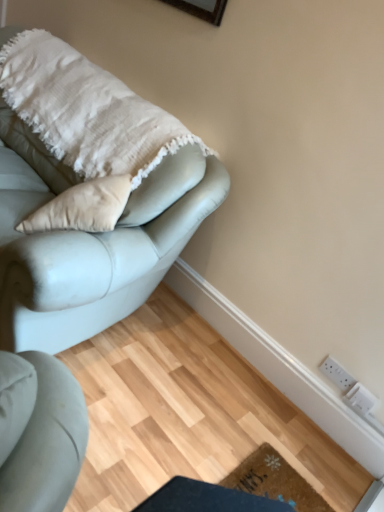
Measure the distance between brown textured mat at lower center and camera.

The depth of brown textured mat at lower center is 1.42 meters.

I want to click on white plastic socket at lower right, which is the first electric outlet in top-to-bottom order, so click(x=337, y=373).

Where is `white textured blanket at upper left`? The image size is (384, 512). white textured blanket at upper left is located at coordinates (86, 111).

Which is correct: white textured blanket at upper left is inside satin light blue couch at upper left, or outside of it?

white textured blanket at upper left lies within the bounds of satin light blue couch at upper left.

Is point (98, 104) less distant than point (12, 225)?

No, (98, 104) is behind (12, 225).

Is satin light blue couch at upper left at the back of white textured blanket at upper left?

Yes, white textured blanket at upper left is facing away from satin light blue couch at upper left.

From a real-world perspective, is white textured blanket at upper left physically located above or below satin light blue couch at upper left?

white textured blanket at upper left is above satin light blue couch at upper left.

From a real-world perspective, who is located higher, white plastic socket at lower right, the 2th electric outlet from the bottom, or white textured blanket at upper left?

From a 3D spatial view, white textured blanket at upper left is above.

Is point (335, 377) positioned after point (135, 188)?

Yes, point (335, 377) is behind point (135, 188).

From the image's perspective, which one is positioned higher, white plastic socket at lower right, which is the first electric outlet in top-to-bottom order, or white textured blanket at upper left?

From the image's view, white textured blanket at upper left is above.

Between white plastic electric outlet at lower right, arranged as the 1th electric outlet when ordered from the bottom, and satin light blue couch at upper left, which one has larger size?

satin light blue couch at upper left.

From the image's perspective, which is below, white plastic electric outlet at lower right, arranged as the 1th electric outlet when ordered from the bottom, or satin light blue couch at upper left?

white plastic electric outlet at lower right, arranged as the 1th electric outlet when ordered from the bottom.

Is white plastic electric outlet at lower right, placed as the 2th electric outlet when sorted from top to bottom, with satin light blue couch at upper left?

No, white plastic electric outlet at lower right, placed as the 2th electric outlet when sorted from top to bottom, is not in contact with satin light blue couch at upper left.

Is the position of white plastic electric outlet at lower right, arranged as the 1th electric outlet when ordered from the bottom, more distant than that of satin light blue couch at upper left?

Yes, white plastic electric outlet at lower right, arranged as the 1th electric outlet when ordered from the bottom, is further from the camera.

Between white textured blanket at upper left and white plastic electric outlet at lower right, placed as the 2th electric outlet when sorted from top to bottom, which one has more height?

white textured blanket at upper left is taller.

Is white textured blanket at upper left not within white plastic electric outlet at lower right, arranged as the 1th electric outlet when ordered from the bottom?

Absolutely, white textured blanket at upper left is external to white plastic electric outlet at lower right, arranged as the 1th electric outlet when ordered from the bottom.

Identify the location of blanket that appears above the white plastic electric outlet at lower right, arranged as the 1th electric outlet when ordered from the bottom (from a real-world perspective). click(x=86, y=111).

Between brown textured mat at lower center and white plastic socket at lower right, which is the first electric outlet in top-to-bottom order, which one has smaller size?

white plastic socket at lower right, which is the first electric outlet in top-to-bottom order, is smaller.

Considering the relative sizes of brown textured mat at lower center and white plastic socket at lower right, the 2th electric outlet from the bottom, in the image provided, is brown textured mat at lower center shorter than white plastic socket at lower right, the 2th electric outlet from the bottom,?

Yes.

You are a GUI agent. You are given a task and a screenshot of the screen. Output one action in this format:
    pyautogui.click(x=<x>, y=<y>)
    Task: Click on the 2nd electric outlet above when counting from the brown textured mat at lower center (from the image's perspective)
    
    Given the screenshot: What is the action you would take?
    pyautogui.click(x=337, y=373)

Is brown textured mat at lower center situated inside white plastic socket at lower right, the 2th electric outlet from the bottom, or outside?

brown textured mat at lower center is outside white plastic socket at lower right, the 2th electric outlet from the bottom.

In terms of height, does white plastic electric outlet at lower right, arranged as the 1th electric outlet when ordered from the bottom, look taller or shorter compared to brown textured mat at lower center?

In the image, white plastic electric outlet at lower right, arranged as the 1th electric outlet when ordered from the bottom, appears to be taller than brown textured mat at lower center.

Between point (362, 400) and point (263, 463), which one is positioned in front?

The point (263, 463) is closer.

In the scene shown: Would you say white plastic electric outlet at lower right, placed as the 2th electric outlet when sorted from top to bottom, is outside brown textured mat at lower center?

Yes, white plastic electric outlet at lower right, placed as the 2th electric outlet when sorted from top to bottom, is not within brown textured mat at lower center.

From the image's perspective, is satin light blue couch at upper left positioned above or below white plastic socket at lower right, which is the first electric outlet in top-to-bottom order?

From the image's perspective, satin light blue couch at upper left appears above white plastic socket at lower right, which is the first electric outlet in top-to-bottom order.

Is white plastic socket at lower right, which is the first electric outlet in top-to-bottom order, at the back of satin light blue couch at upper left?

No, satin light blue couch at upper left is not facing the opposite direction of white plastic socket at lower right, which is the first electric outlet in top-to-bottom order.

Is satin light blue couch at upper left further to the viewer compared to white plastic socket at lower right, which is the first electric outlet in top-to-bottom order?

That is False.

Could you measure the distance between satin light blue couch at upper left and white plastic socket at lower right, the 2th electric outlet from the bottom?

satin light blue couch at upper left and white plastic socket at lower right, the 2th electric outlet from the bottom, are 3.92 feet apart from each other.

Image resolution: width=384 pixels, height=512 pixels. In order to click on studio couch in front of the white textured blanket at upper left in this screenshot , I will do [x=89, y=242].

The height and width of the screenshot is (512, 384). Identify the location of the 2nd electric outlet behind the white textured blanket at upper left. (337, 373).

Based on their spatial positions, is white plastic electric outlet at lower right, placed as the 2th electric outlet when sorted from top to bottom, or brown textured mat at lower center closer to satin light blue couch at upper left?

Based on the image, brown textured mat at lower center appears to be nearer to satin light blue couch at upper left.

Estimate the real-world distances between objects in this image. Which object is closer to brown textured mat at lower center, white plastic electric outlet at lower right, placed as the 2th electric outlet when sorted from top to bottom, or satin light blue couch at upper left?

white plastic electric outlet at lower right, placed as the 2th electric outlet when sorted from top to bottom, lies closer to brown textured mat at lower center than the other object.

Based on their spatial positions, is satin light blue couch at upper left or white plastic socket at lower right, which is the first electric outlet in top-to-bottom order, further from white plastic electric outlet at lower right, arranged as the 1th electric outlet when ordered from the bottom?

satin light blue couch at upper left is further to white plastic electric outlet at lower right, arranged as the 1th electric outlet when ordered from the bottom.

Consider the image. When comparing their distances from white plastic electric outlet at lower right, placed as the 2th electric outlet when sorted from top to bottom, does satin light blue couch at upper left or white textured blanket at upper left seem closer?

Based on the image, satin light blue couch at upper left appears to be nearer to white plastic electric outlet at lower right, placed as the 2th electric outlet when sorted from top to bottom.

Estimate the real-world distances between objects in this image. Which object is closer to brown textured mat at lower center, satin light blue couch at upper left or white textured blanket at upper left?

Among the two, satin light blue couch at upper left is located nearer to brown textured mat at lower center.

Considering their positions, is white textured blanket at upper left positioned further to white plastic electric outlet at lower right, arranged as the 1th electric outlet when ordered from the bottom, than brown textured mat at lower center?

white textured blanket at upper left.

When comparing their distances from satin light blue couch at upper left, does white textured blanket at upper left or white plastic socket at lower right, which is the first electric outlet in top-to-bottom order, seem closer?

white textured blanket at upper left.

Consider the image. Based on their spatial positions, is white plastic electric outlet at lower right, arranged as the 1th electric outlet when ordered from the bottom, or white textured blanket at upper left further from brown textured mat at lower center?

white textured blanket at upper left is further to brown textured mat at lower center.

Identify the location of blanket situated between satin light blue couch at upper left and white plastic electric outlet at lower right, placed as the 2th electric outlet when sorted from top to bottom, from left to right. Image resolution: width=384 pixels, height=512 pixels. (86, 111).

Image resolution: width=384 pixels, height=512 pixels. In order to click on studio couch that lies between white textured blanket at upper left and brown textured mat at lower center from top to bottom in this screenshot , I will do `click(89, 242)`.

The image size is (384, 512). In order to click on electric outlet between satin light blue couch at upper left and white plastic electric outlet at lower right, arranged as the 1th electric outlet when ordered from the bottom in this screenshot , I will do [x=337, y=373].

Find the location of a particular element. The width and height of the screenshot is (384, 512). electric outlet between brown textured mat at lower center and white plastic socket at lower right, the 2th electric outlet from the bottom, from front to back is located at coordinates (359, 398).